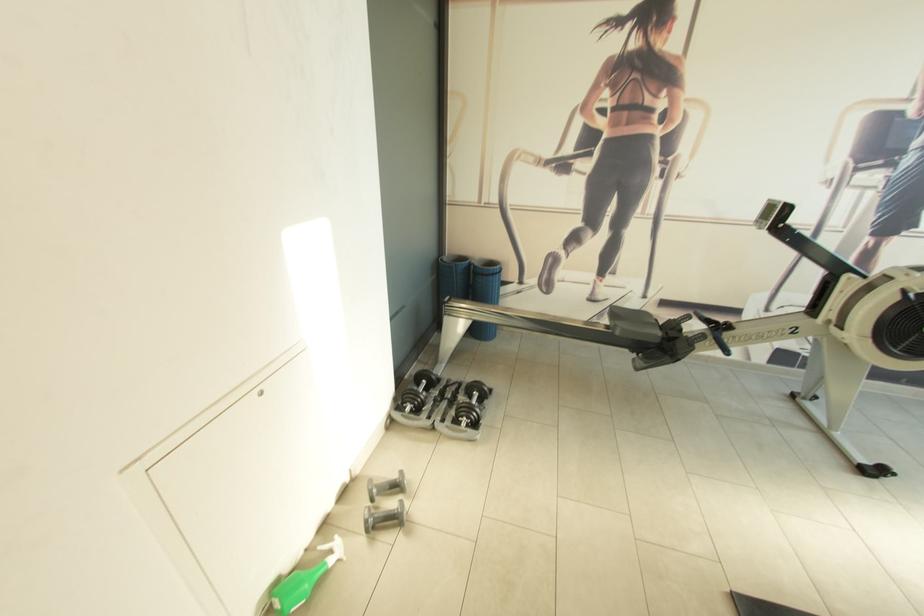
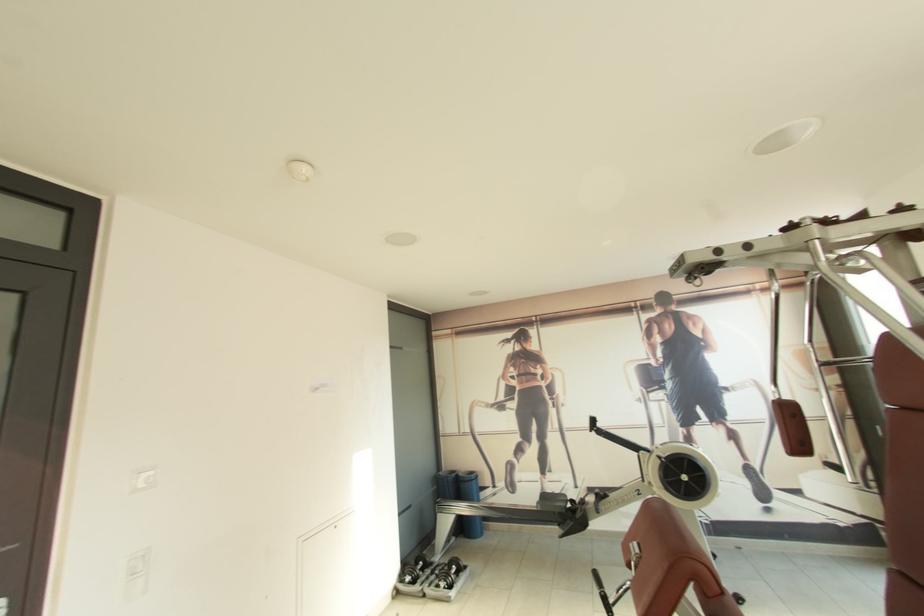
Where in the second image is the point corresponding to (505,212) from the first image?

(476, 438)